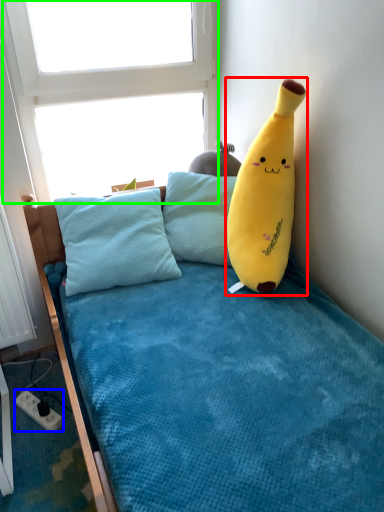
Question: Considering the real-world distances, which object is farthest from toy (highlighted by a red box)? power outlet (highlighted by a blue box) or window screen (highlighted by a green box)?

Choices:
 (A) power outlet
 (B) window screen

Answer: (A)